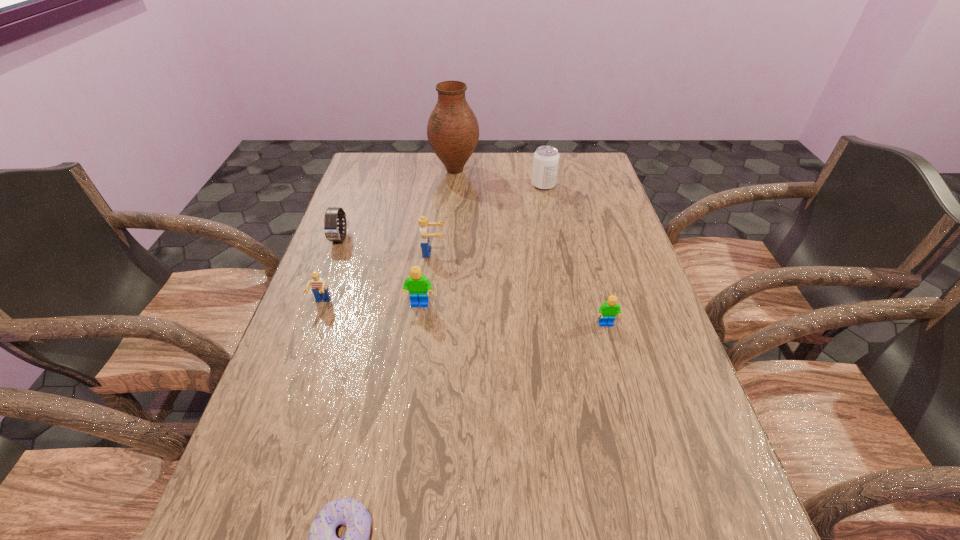
Identify the location of free space that satisfies the following two spatial constraints: 1. on the face of the farther blue Lego; 2. on the face of the smaller blue Lego. pos(427,303).

Locate an element on the screen. free spot that satisfies the following two spatial constraints: 1. on the face of the farther blue Lego; 2. on the face of the farther green Lego is located at coordinates (426, 305).